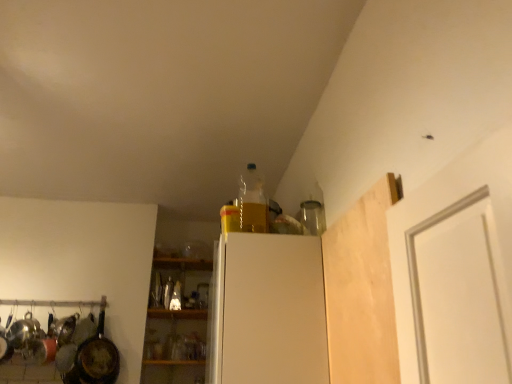
Question: Looking at the image, does rusty metal frying pan at left seem bigger or smaller compared to light wood/rough plank at upper right?

Choices:
 (A) big
 (B) small

Answer: (A)

Question: Relative to light wood/rough plank at upper right, is rusty metal frying pan at left in front or behind?

Choices:
 (A) behind
 (B) front

Answer: (A)

Question: Which of these objects is positioned closest to the translucent glass bottle at center, the 1th bottle positioned from the back?

Choices:
 (A) translucent plastic bottle at upper center, marked as the 1th bottle in a right-to-left arrangement
 (B) light wood/rough plank at upper right
 (C) rusty metal frying pan at left
 (D) translucent glass bottle at center, which ranks as the 1th bottle in left-to-right order
 (E) white matte refrigerator at center

Answer: (D)

Question: Estimate the real-world distances between objects in this image. Which object is closer to the light wood/rough plank at upper right?

Choices:
 (A) rusty metal frying pan at left
 (B) translucent glass bottle at center, which is the third bottle in right-to-left order
 (C) translucent plastic bottle at upper center, marked as the 1th bottle in a right-to-left arrangement
 (D) white matte refrigerator at center
 (E) translucent glass bottle at center, which appears as the 3th bottle when viewed from the front

Answer: (D)